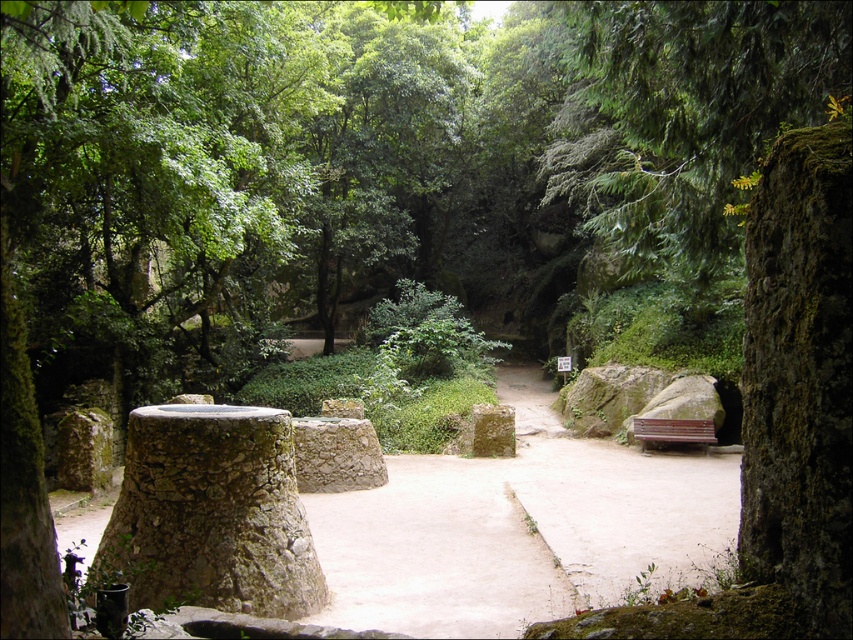
You are a gardener who wants to place a small potted plant between the smooth stone path at center and the green mossy stone at center. Which object should you place the plant closer to so it gets more sunlight?

The smooth stone path at center is much taller than the green mossy stone at center, so placing the plant closer to the smooth stone path at center would provide more sunlight as it is taller and may cast less shadow over the plant compared to the shorter green mossy stone at center.

You are a gardener who needs to place a 6.5 feet long wooden bench along the smooth stone path at center and the green mossy stone at center. Can you fit the bench between them without moving either object?

The smooth stone path at center and the green mossy stone at center are 6.48 feet apart from each other. Since the bench is 6.5 feet long, it would be slightly too long to fit between them without moving either object.

In the scene shown: You are a gardener walking along the smooth stone path at center and the green mossy stone at center. Which direction should you turn to face the mossy stone?

The smooth stone path at center is to the left of green mossy stone at center, so you should turn to your right to face the mossy stone.